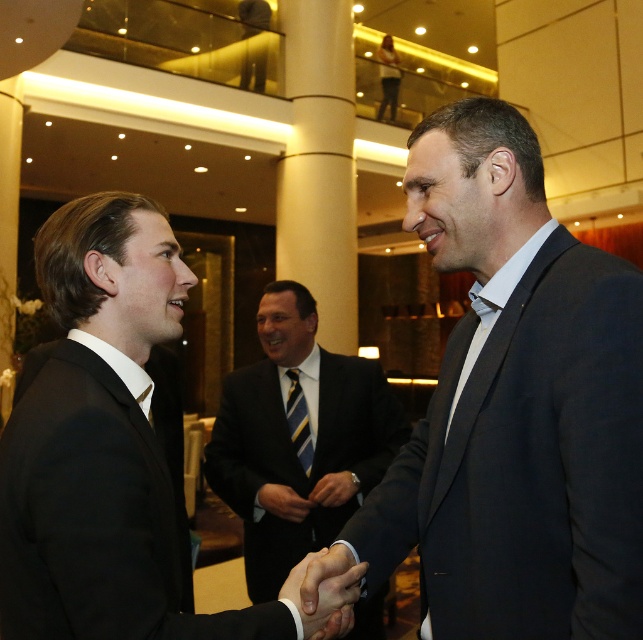
Between point (95, 588) and point (341, 557), which one is positioned in front?

Positioned in front is point (95, 588).

The image size is (643, 640). What are the coordinates of `black suit at left` in the screenshot? It's located at (102, 445).

I want to click on black suit at left, so click(x=102, y=445).

Which is behind, point (514, 337) or point (403, 433)?

Point (403, 433)

Is dark gray suit at center taller than dark suit at center?

No, dark gray suit at center is not taller than dark suit at center.

Which is behind, point (480, 108) or point (399, 442)?

The point (399, 442) is behind.

Find the location of a particular element. This screenshot has height=640, width=643. dark gray suit at center is located at coordinates (516, 406).

Which of these two, smooth leather hand at center or smooth black hand at center, stands shorter?

With less height is smooth black hand at center.

How distant is smooth leather hand at center from smooth black hand at center?

A distance of 1.08 meters exists between smooth leather hand at center and smooth black hand at center.

The image size is (643, 640). What do you see at coordinates (323, 592) in the screenshot? I see `smooth leather hand at center` at bounding box center [323, 592].

This screenshot has width=643, height=640. In order to click on smooth leather hand at center in this screenshot , I will do `click(323, 592)`.